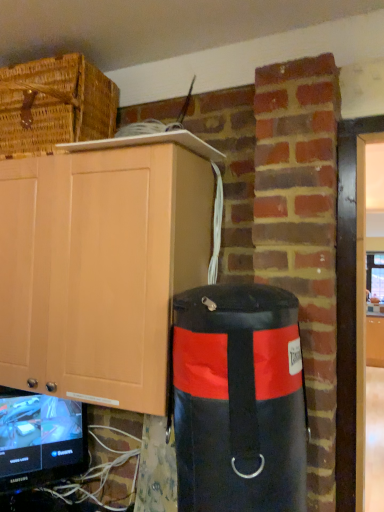
At what (x,y) coordinates should I click in order to perform the action: click on black glossy television at lower left. Please return your answer as a coordinate pair (x, y). This screenshot has width=384, height=512. Looking at the image, I should click on (40, 439).

Where is `matte wood cabinet at center, arranged as the second cabinetry when viewed from the top`? matte wood cabinet at center, arranged as the second cabinetry when viewed from the top is located at coordinates (375, 341).

Consider the image. Is black leather punching bag at right a part of matte wood cabinet at center, the 1th cabinetry in the bottom-to-top sequence?

No, black leather punching bag at right is not inside matte wood cabinet at center, the 1th cabinetry in the bottom-to-top sequence.

From the image's perspective, which is above, matte wood cabinet at center, acting as the 1th cabinetry starting from the right, or black leather punching bag at right?

black leather punching bag at right is shown above in the image.

Which object is positioned more to the left, matte wood cabinet at center, the 1th cabinetry in the bottom-to-top sequence, or black leather punching bag at right?

From the viewer's perspective, black leather punching bag at right appears more on the left side.

In order to click on cabinetry that is the 2nd one when counting backward from the black leather punching bag at right in this screenshot , I will do `click(375, 341)`.

Which object is positioned more to the left, black leather punching bag at right or matte wood cabinet at center, arranged as the second cabinetry when viewed from the front?

black leather punching bag at right is more to the left.

Is black leather punching bag at right not close to matte wood cabinet at center, arranged as the second cabinetry when viewed from the top?

black leather punching bag at right is near matte wood cabinet at center, arranged as the second cabinetry when viewed from the top, not far away.

Who is taller, black leather punching bag at right or matte wood cabinet at center, arranged as the second cabinetry when viewed from the top?

Standing taller between the two is matte wood cabinet at center, arranged as the second cabinetry when viewed from the top.

Between black leather punching bag at right and matte wood cabinet at center, the second cabinetry from the left, which one is positioned behind?

matte wood cabinet at center, the second cabinetry from the left, is behind.

From a real-world perspective, which is physically below, matte wood cabinet at upper left, marked as the second cabinetry in a back-to-front arrangement, or black glossy television at lower left?

black glossy television at lower left.

Is matte wood cabinet at upper left, marked as the second cabinetry in a back-to-front arrangement, with black glossy television at lower left?

There is a gap between matte wood cabinet at upper left, marked as the second cabinetry in a back-to-front arrangement, and black glossy television at lower left.

Is matte wood cabinet at upper left, which ranks as the first cabinetry in top-to-bottom order, in front of or behind black glossy television at lower left in the image?

In the image, matte wood cabinet at upper left, which ranks as the first cabinetry in top-to-bottom order, appears in front of black glossy television at lower left.

You are a GUI agent. You are given a task and a screenshot of the screen. Output one action in this format:
    pyautogui.click(x=<x>, y=<y>)
    Task: Click on the television to the left of matte wood cabinet at upper left, which is the 1th cabinetry in left-to-right order
    
    Given the screenshot: What is the action you would take?
    point(40,439)

Can you tell me how much matte wood cabinet at center, arranged as the second cabinetry when viewed from the front, and woven brown basket at upper left differ in facing direction?

The angle between the facing direction of matte wood cabinet at center, arranged as the second cabinetry when viewed from the front, and the facing direction of woven brown basket at upper left is 0.946 degrees.

Is matte wood cabinet at center, arranged as the second cabinetry when viewed from the top, to the right of woven brown basket at upper left from the viewer's perspective?

Correct, you'll find matte wood cabinet at center, arranged as the second cabinetry when viewed from the top, to the right of woven brown basket at upper left.

Find the location of a particular element. Image resolution: width=384 pixels, height=512 pixels. cabinetry behind the woven brown basket at upper left is located at coordinates (375, 341).

Can you confirm if black leather punching bag at right is thinner than woven brown basket at upper left?

Yes, black leather punching bag at right is thinner than woven brown basket at upper left.

Where is `punching bag that is under the woven brown basket at upper left (from a real-world perspective)`? The image size is (384, 512). punching bag that is under the woven brown basket at upper left (from a real-world perspective) is located at coordinates (239, 400).

From a real-world perspective, is black leather punching bag at right positioned above or below woven brown basket at upper left?

black leather punching bag at right is below woven brown basket at upper left.

Is black leather punching bag at right next to woven brown basket at upper left and touching it?

No, black leather punching bag at right is not touching woven brown basket at upper left.

Which point is more distant from viewer, (22, 455) or (153, 293)?

The point (22, 455) is farther.

From a real-world perspective, is black glossy television at lower left located higher than matte wood cabinet at upper left, marked as the second cabinetry in a back-to-front arrangement?

No, from a real-world perspective, black glossy television at lower left is not over matte wood cabinet at upper left, marked as the second cabinetry in a back-to-front arrangement

Does black glossy television at lower left have a lesser width compared to matte wood cabinet at upper left, marked as the second cabinetry in a back-to-front arrangement?

Indeed, black glossy television at lower left has a lesser width compared to matte wood cabinet at upper left, marked as the second cabinetry in a back-to-front arrangement.

Based on the photo, based on their sizes in the image, would you say black glossy television at lower left is bigger or smaller than matte wood cabinet at upper left, which ranks as the second cabinetry in right-to-left order?

Clearly, black glossy television at lower left is smaller in size than matte wood cabinet at upper left, which ranks as the second cabinetry in right-to-left order.

Which is in front, point (375, 366) or point (199, 274)?

Point (375, 366)

Is matte wood cabinet at center, the second cabinetry from the left, wider than matte wood cabinet at upper left, which is the first cabinetry in front-to-back order?

Indeed, matte wood cabinet at center, the second cabinetry from the left, has a greater width compared to matte wood cabinet at upper left, which is the first cabinetry in front-to-back order.

Locate an element on the screen. Image resolution: width=384 pixels, height=512 pixels. punching bag that appears in front of the matte wood cabinet at center, the 1th cabinetry positioned from the back is located at coordinates (239, 400).

Find the location of `punching bag above the matte wood cabinet at center, the 1th cabinetry in the bottom-to-top sequence (from a real-world perspective)`. punching bag above the matte wood cabinet at center, the 1th cabinetry in the bottom-to-top sequence (from a real-world perspective) is located at coordinates (239, 400).

Based on their spatial positions, is black leather punching bag at right or matte wood cabinet at upper left, which is the 1th cabinetry in left-to-right order, closer to matte wood cabinet at center, the 1th cabinetry positioned from the back?

black leather punching bag at right.

Looking at the image, which one is located closer to black leather punching bag at right, woven brown basket at upper left or black glossy television at lower left?

Based on the image, black glossy television at lower left appears to be nearer to black leather punching bag at right.

Which object lies further to the anchor point black glossy television at lower left, matte wood cabinet at upper left, which is the first cabinetry in front-to-back order, or matte wood cabinet at center, arranged as the second cabinetry when viewed from the top?

matte wood cabinet at center, arranged as the second cabinetry when viewed from the top.

From the image, which object appears to be farther from matte wood cabinet at center, arranged as the second cabinetry when viewed from the top, black leather punching bag at right or woven brown basket at upper left?

Among the two, woven brown basket at upper left is located further to matte wood cabinet at center, arranged as the second cabinetry when viewed from the top.

Looking at the image, which one is located further to black glossy television at lower left, matte wood cabinet at upper left, arranged as the 2th cabinetry when ordered from the bottom, or woven brown basket at upper left?

The object further to black glossy television at lower left is woven brown basket at upper left.

When comparing their distances from woven brown basket at upper left, does black glossy television at lower left or matte wood cabinet at center, the second cabinetry from the left, seem further?

matte wood cabinet at center, the second cabinetry from the left.

In the scene shown: From the image, which object appears to be farther from woven brown basket at upper left, black glossy television at lower left or black leather punching bag at right?

Among the two, black glossy television at lower left is located further to woven brown basket at upper left.

When comparing their distances from black glossy television at lower left, does woven brown basket at upper left or matte wood cabinet at center, arranged as the second cabinetry when viewed from the top, seem further?

Among the two, matte wood cabinet at center, arranged as the second cabinetry when viewed from the top, is located further to black glossy television at lower left.

Image resolution: width=384 pixels, height=512 pixels. Find the location of `television located between matte wood cabinet at upper left, marked as the second cabinetry in a back-to-front arrangement, and matte wood cabinet at center, arranged as the second cabinetry when viewed from the front, in the depth direction`. television located between matte wood cabinet at upper left, marked as the second cabinetry in a back-to-front arrangement, and matte wood cabinet at center, arranged as the second cabinetry when viewed from the front, in the depth direction is located at coordinates (40, 439).

Identify the location of basket between black leather punching bag at right and matte wood cabinet at center, the 1th cabinetry positioned from the back, from front to back. (55, 104).

You are a GUI agent. You are given a task and a screenshot of the screen. Output one action in this format:
    pyautogui.click(x=<x>, y=<y>)
    Task: Click on the cabinetry between woven brown basket at upper left and black glossy television at lower left vertically
    
    Given the screenshot: What is the action you would take?
    pyautogui.click(x=99, y=269)

Locate an element on the screen. This screenshot has height=512, width=384. television located between black leather punching bag at right and matte wood cabinet at center, the 1th cabinetry in the bottom-to-top sequence, in the depth direction is located at coordinates (40, 439).